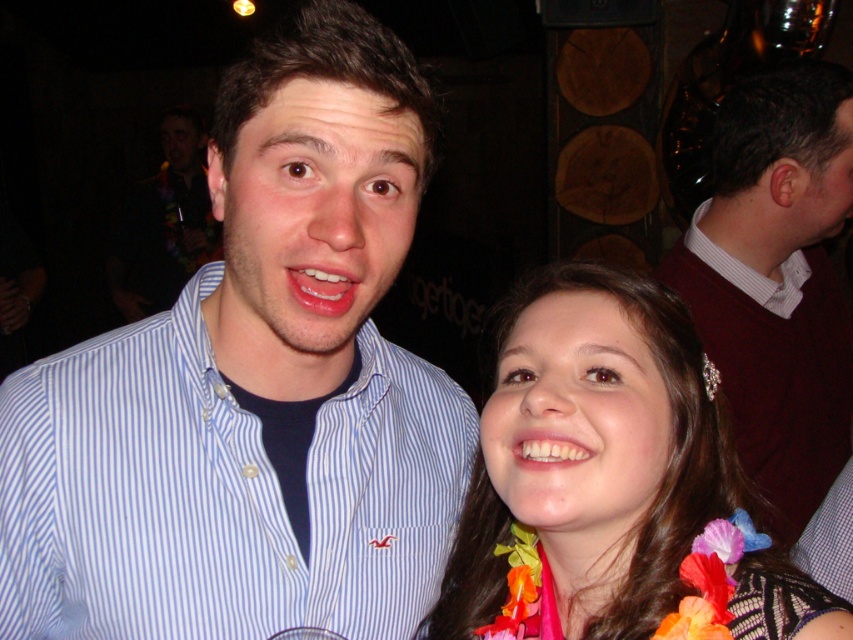
You are a photographer trying to focus on the blue striped shirt at center and the white glossy teeth at center. Which one is positioned higher in the frame?

The blue striped shirt at center is above the white glossy teeth at center, so the blue striped shirt at center is positioned higher in the frame.

You are a photographer trying to adjust the lighting for a group photo. You notice the maroon sweater at right and the white striped shirt at upper right. Which clothing item should you focus on first to ensure proper exposure, considering their sizes?

The maroon sweater at right has a greater height compared to the white striped shirt at upper right, so you should focus on the maroon sweater at right first because it is larger and might require more attention for proper exposure.

You are a photographer trying to frame a closeup shot of both the floral necklace at center and the glossy pink lips at center. Given their sizes, which one should you focus on to ensure both fit within the camera frame?

The floral necklace at center is wider than the glossy pink lips at center, so focusing on the floral necklace at center ensures both fit within the camera frame.